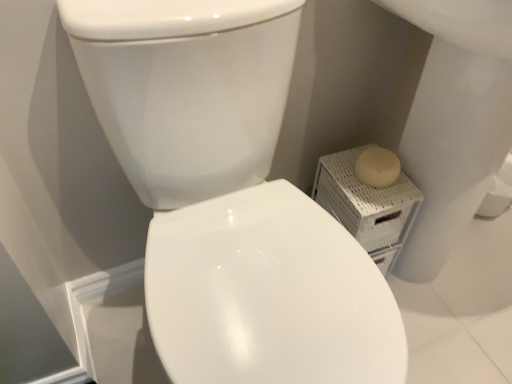
This screenshot has width=512, height=384. What are the coordinates of `vacant area that is situated to the right of beige wicker basket at right` in the screenshot? It's located at (426, 295).